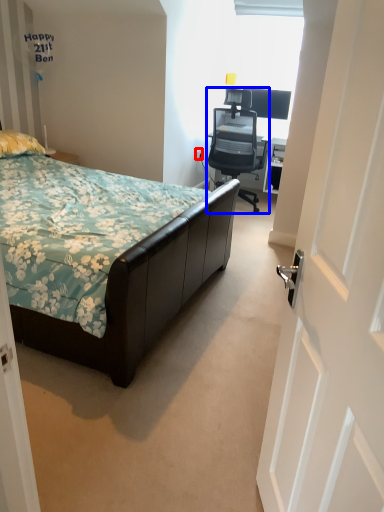
Question: Which of the following is the closest to the observer, power outlet (highlighted by a red box) or chair (highlighted by a blue box)?

Choices:
 (A) power outlet
 (B) chair

Answer: (B)